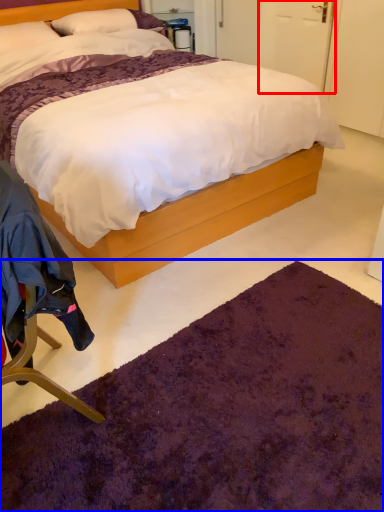
Question: Which object is further to the camera taking this photo, door (highlighted by a red box) or mat (highlighted by a blue box)?

Choices:
 (A) door
 (B) mat

Answer: (A)